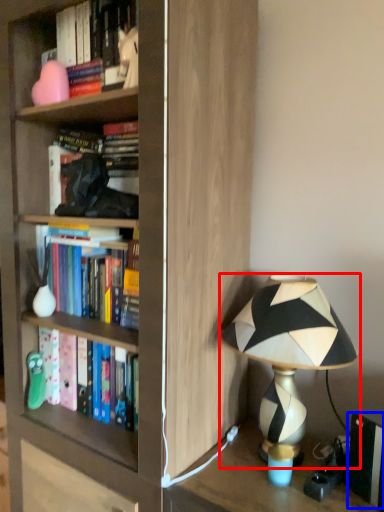
Question: Which of the following is the closest to the observer, lamp (highlighted by a red box) or paperback book (highlighted by a blue box)?

Choices:
 (A) lamp
 (B) paperback book

Answer: (A)